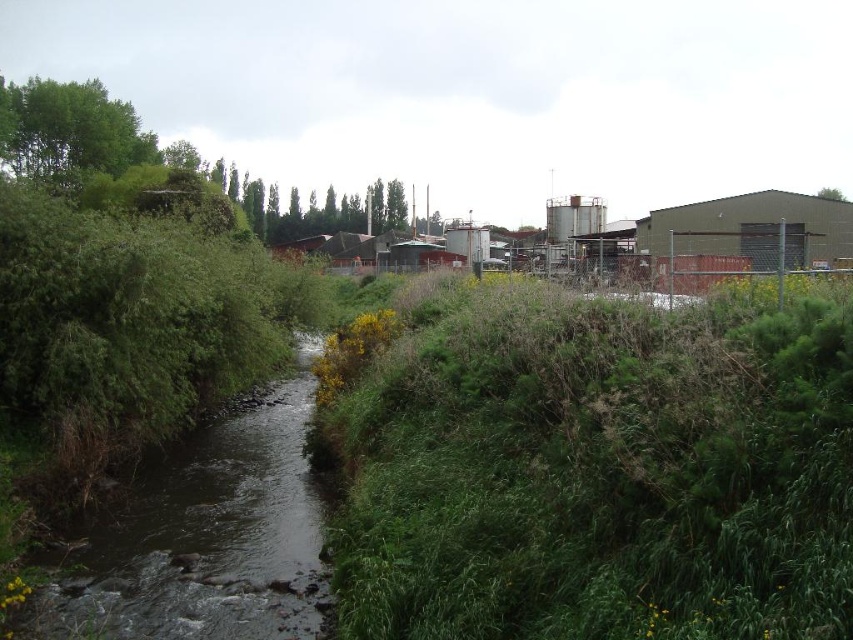
Based on the photo, you are standing at the edge of the river and want to cross to the other side. The green grassy patch at center and the dark brown water at center are both visible. Which one should you step on to avoid getting your shoes wet?

The green grassy patch at center is closer to the viewer than the dark brown water at center, so stepping on the green grassy patch at center would keep your shoes dry as it is above the water level.

You are a gardener planning to plant flowers in the green grassy patch at center and dark brown water at center. Which area can you plant flowers in?

The green grassy patch at center is suitable for planting flowers since it is a grassy area, while the dark brown water at center is a water body and not suitable for planting.

You are a small frog that can only jump 10 cm high. You are currently on the green grassy patch at center and want to jump to the dark brown water at center. Can you make the jump?

The green grassy patch at center is taller than dark brown water at center, so the frog can jump from the green grassy patch at center to the dark brown water at center because the water is lower in height.